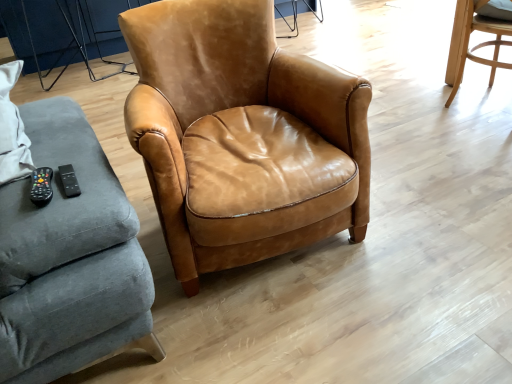
Where is `vacant region in front of cognac leather armchair at center, the 2th chair when ordered from right to left`? vacant region in front of cognac leather armchair at center, the 2th chair when ordered from right to left is located at coordinates (318, 333).